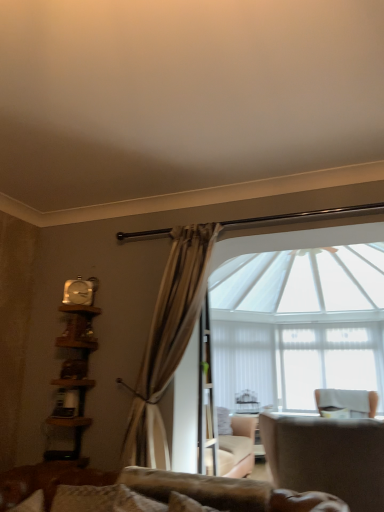
Question: Is white fabric chair at right, acting as the 2th chair starting from the left, further to the viewer compared to metallic silver clock at upper left?

Choices:
 (A) yes
 (B) no

Answer: (A)

Question: Is white fabric chair at right, the 1th chair in the right-to-left sequence, not inside metallic silver clock at upper left?

Choices:
 (A) yes
 (B) no

Answer: (A)

Question: Is white fabric chair at right, which appears as the 2th chair when viewed from the top, taller than metallic silver clock at upper left?

Choices:
 (A) no
 (B) yes

Answer: (B)

Question: Is white fabric chair at right, which is counted as the second chair, starting from the front, bigger than metallic silver clock at upper left?

Choices:
 (A) yes
 (B) no

Answer: (A)

Question: From the image's perspective, is white fabric chair at right, acting as the 2th chair starting from the left, over metallic silver clock at upper left?

Choices:
 (A) no
 (B) yes

Answer: (A)

Question: Based on their positions, is metallic silver clock at upper left located to the left or right of white sheer fabric at center?

Choices:
 (A) right
 (B) left

Answer: (B)

Question: From the image's perspective, is metallic silver clock at upper left above or below white sheer fabric at center?

Choices:
 (A) below
 (B) above

Answer: (B)

Question: Is metallic silver clock at upper left in front of or behind white sheer fabric at center in the image?

Choices:
 (A) behind
 (B) front

Answer: (B)

Question: From their relative heights in the image, would you say metallic silver clock at upper left is taller or shorter than white sheer fabric at center?

Choices:
 (A) short
 (B) tall

Answer: (A)

Question: Is white sheer fabric at center spatially inside wooden bookshelf at left, or outside of it?

Choices:
 (A) inside
 (B) outside

Answer: (B)

Question: From the image's perspective, is white sheer fabric at center positioned above or below wooden bookshelf at left?

Choices:
 (A) below
 (B) above

Answer: (A)

Question: Considering the positions of white sheer fabric at center and wooden bookshelf at left in the image, is white sheer fabric at center taller or shorter than wooden bookshelf at left?

Choices:
 (A) tall
 (B) short

Answer: (A)

Question: Is white sheer fabric at center to the left or to the right of wooden bookshelf at left in the image?

Choices:
 (A) right
 (B) left

Answer: (A)

Question: Looking at the image, does metallic silver clock at upper left seem bigger or smaller compared to leather-like beige armchair at lower right, marked as the 2th chair in a right-to-left arrangement?

Choices:
 (A) big
 (B) small

Answer: (B)

Question: Would you say metallic silver clock at upper left is inside or outside leather-like beige armchair at lower right, marked as the 2th chair in a right-to-left arrangement?

Choices:
 (A) outside
 (B) inside

Answer: (A)